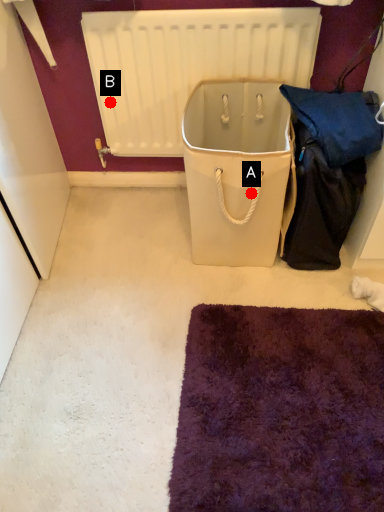
Question: Two points are circled on the image, labeled by A and B beside each circle. Which point is closer to the camera taking this photo?

Choices:
 (A) A is closer
 (B) B is closer

Answer: (A)